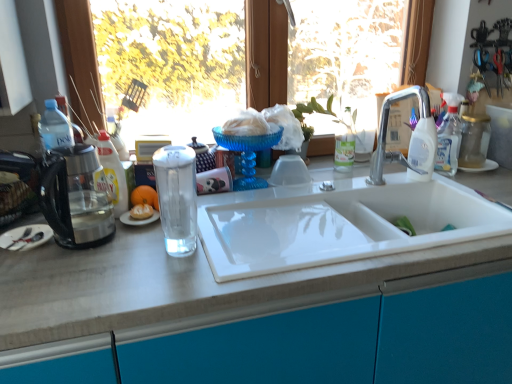
Where is `vacant space situated on the left part of white glossy bottle at upper right`? The height and width of the screenshot is (384, 512). vacant space situated on the left part of white glossy bottle at upper right is located at coordinates (370, 179).